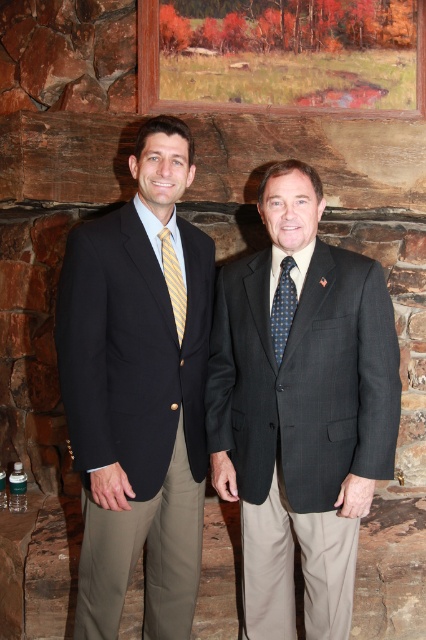
Consider the image. You are standing in the room where the two men are posing. You want to place a small decorative item exactly at the location of point (230, 106) and point (164, 268). If you walk towards both points from the entrance, which point will you reach first?

Point (164, 268) will be reached first because it is in front of point (230, 106) according to their coordinates.

Where is the matte black suit at center located in the image?

The matte black suit at center is located at point 0.616 on the x axis and 0.324 on the y axis.

You are an interior designer assessing the space between two objects in the scene. The matte black suit at center and the wooden frame at upper center are both present. Which object takes up more space visually in the image?

The matte black suit at center is larger in size than the wooden frame at upper center, so it takes up more visual space in the image.